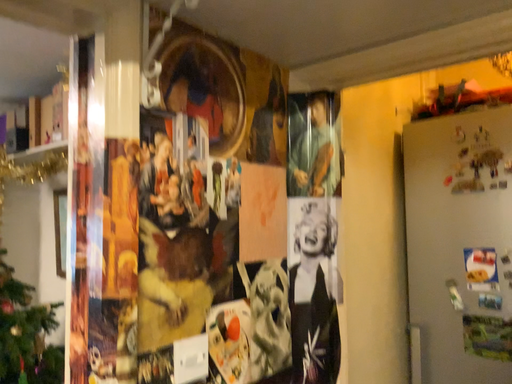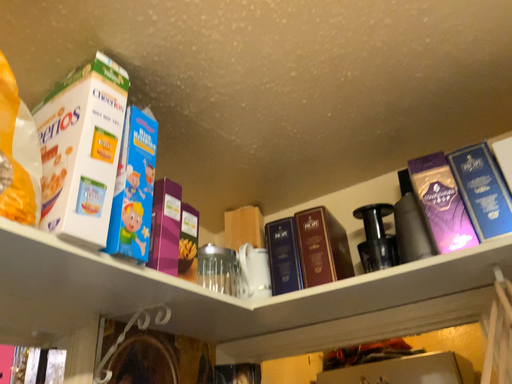
Question: Which way did the camera rotate in the video?

Choices:
 (A) rotated left
 (B) rotated right

Answer: (B)